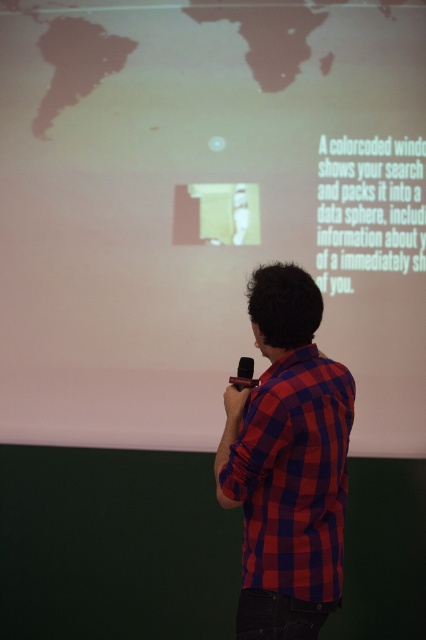
Between white matte projection screen at upper center and red checkered shirt at center, which one appears on the right side from the viewer's perspective?

red checkered shirt at center

The height and width of the screenshot is (640, 426). What do you see at coordinates (206, 208) in the screenshot?
I see `white matte projection screen at upper center` at bounding box center [206, 208].

The image size is (426, 640). In order to click on white matte projection screen at upper center in this screenshot , I will do `click(206, 208)`.